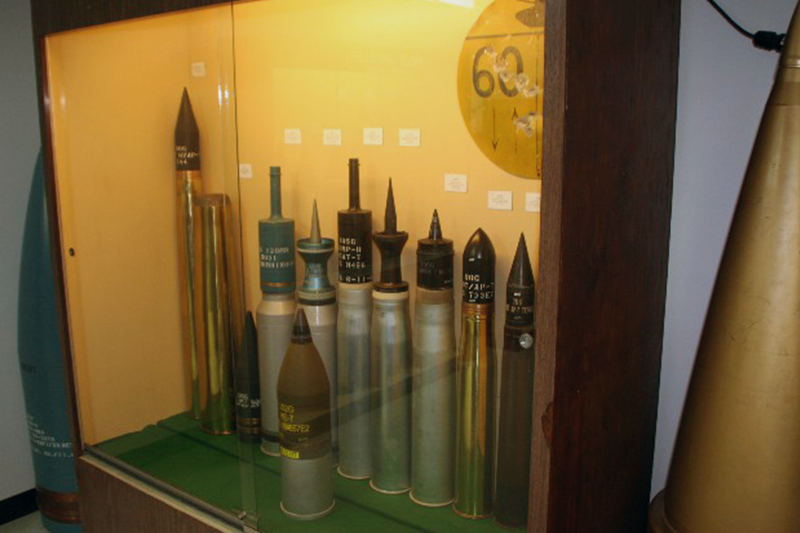
Where is `glass`? glass is located at coordinates (390, 109).